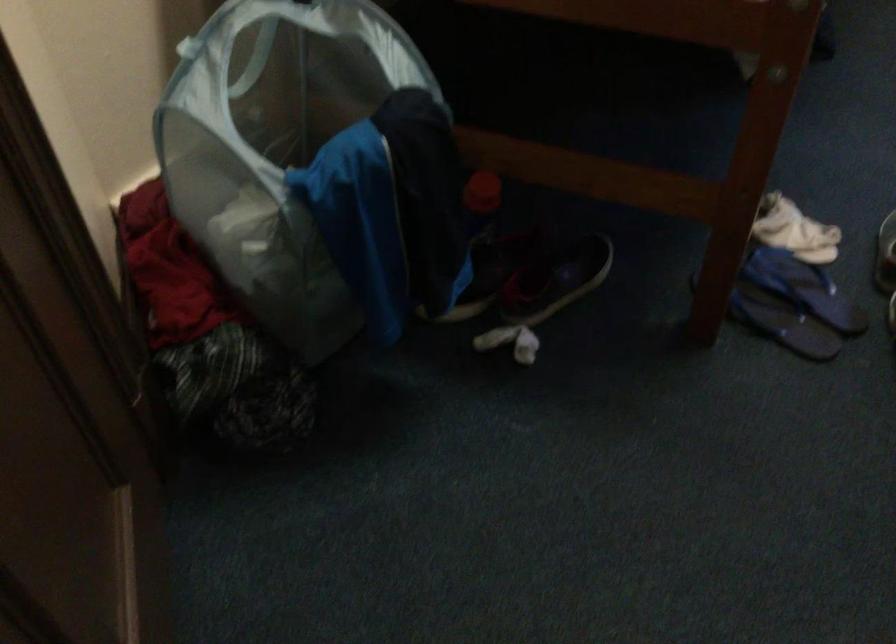
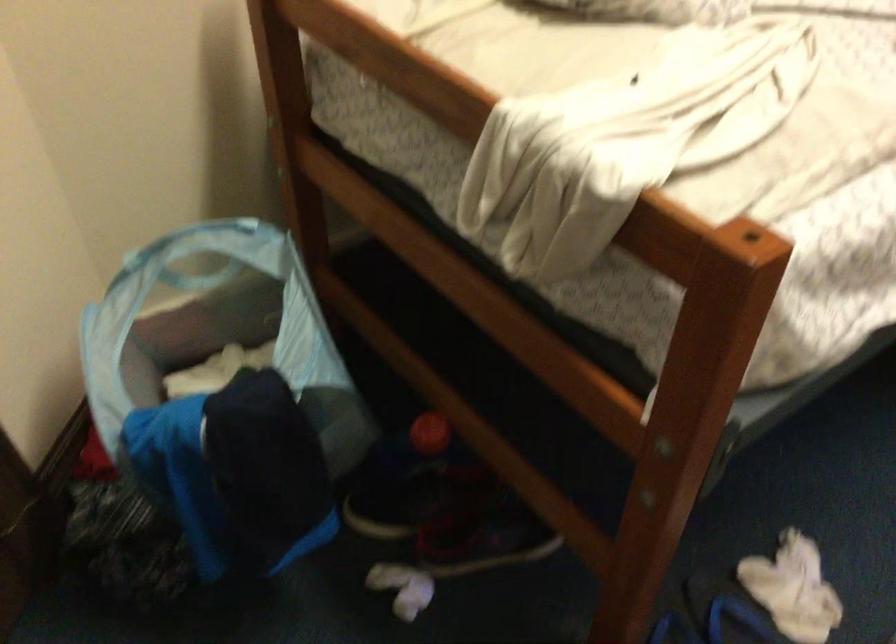
Question: The camera is either moving clockwise (left) or counter-clockwise (right) around the object. The first image is from the beginning of the video and the second image is from the end. Is the camera moving left or right when shooting the video?

Choices:
 (A) Left
 (B) Right

Answer: (B)